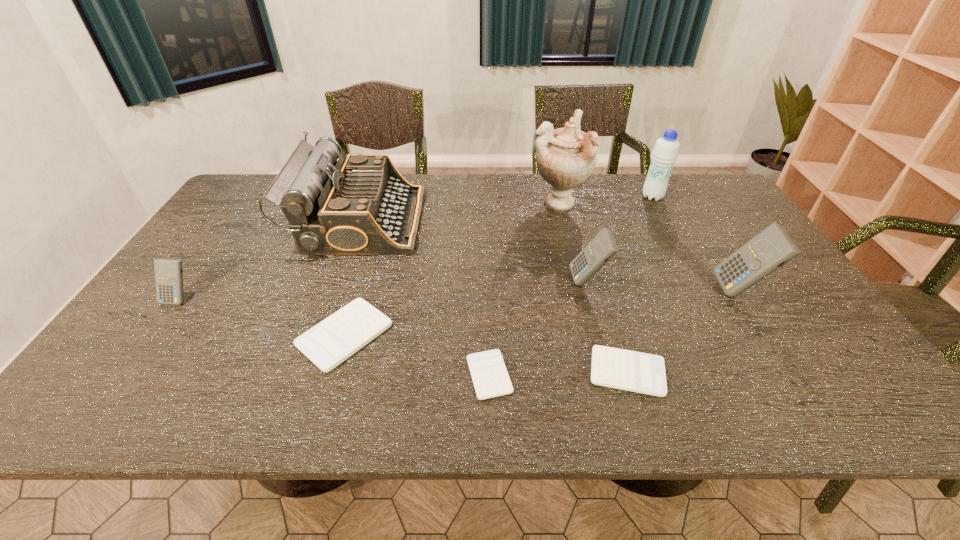
Identify which calculator is the third closest to the leftmost calculator. Please provide its 2D coordinates. Your answer should be formatted as a tuple, i.e. [(x, y)], where the tuple contains the x and y coordinates of a point satisfying the conditions above.

[(603, 247)]

Where is `blue calculator that is the third closest to the urn`? Image resolution: width=960 pixels, height=540 pixels. blue calculator that is the third closest to the urn is located at coordinates (168, 272).

The image size is (960, 540). Identify the location of blue calculator that is the third nearest to the leftmost white calculator. (772, 248).

You are a GUI agent. You are given a task and a screenshot of the screen. Output one action in this format:
    pyautogui.click(x=<x>, y=<y>)
    Task: Click on the closest white calculator relative to the fifth tallest calculator
    This screenshot has height=540, width=960.
    Given the screenshot: What is the action you would take?
    pyautogui.click(x=489, y=374)

Locate an element on the screen. This screenshot has height=540, width=960. white calculator that is the third closest to the tallest object is located at coordinates (x=489, y=374).

The image size is (960, 540). I want to click on vacant space that satisfies the following two spatial constraints: 1. on the keyboard of the typewriter; 2. on the left side of the rightmost white calculator, so click(x=307, y=372).

Where is `blank space that satisfies the following two spatial constraints: 1. on the keyboard of the typewriter; 2. on the right side of the fourth object from left to right`? The image size is (960, 540). blank space that satisfies the following two spatial constraints: 1. on the keyboard of the typewriter; 2. on the right side of the fourth object from left to right is located at coordinates (306, 375).

At what (x,y) coordinates should I click in order to perform the action: click on vacant space that satisfies the following two spatial constraints: 1. on the front-facing side of the second smallest white calculator; 2. on the right side of the smallest blue calculator. Please return your answer as a coordinate pair (x, y). The image size is (960, 540). Looking at the image, I should click on (128, 372).

The image size is (960, 540). In order to click on vacant point that satisfies the following two spatial constraints: 1. on the keyboard of the typewriter; 2. on the front-facing side of the leftmost calculator in this screenshot , I will do `click(333, 299)`.

At what (x,y) coordinates should I click in order to perform the action: click on blank area in the image that satisfies the following two spatial constraints: 1. on the back side of the fourth tallest calculator; 2. on the keyboard of the typewriter. Please return your answer as a coordinate pair (x, y). Looking at the image, I should click on (378, 220).